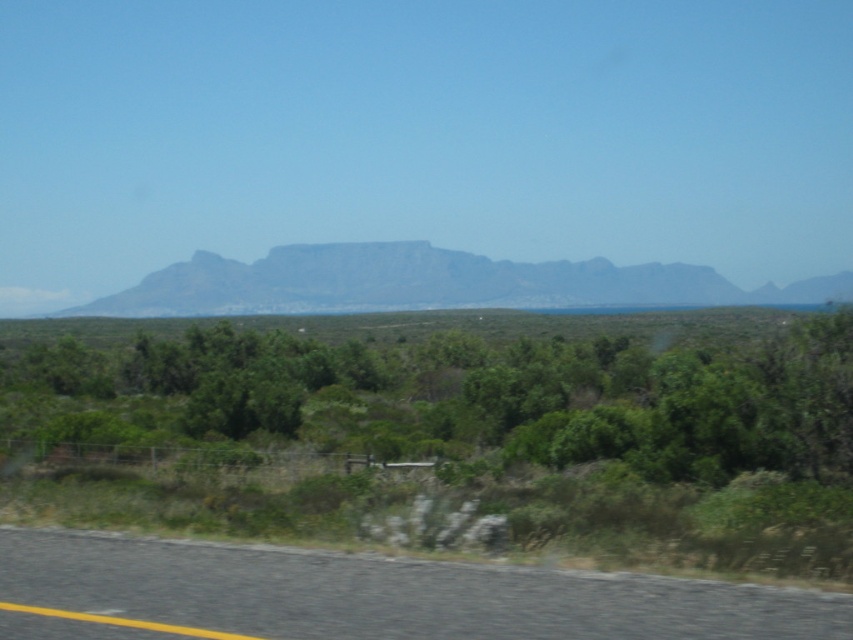
Does point (541, 358) lie behind point (520, 282)?

No, it is in front of (520, 282).

Which is more to the left, green leafy shrub at center or gray rocky mountain at center?

Positioned to the left is green leafy shrub at center.

Find the location of a particular element. This screenshot has width=853, height=640. green leafy shrub at center is located at coordinates pos(457,396).

Is point (508, 570) positioned before point (350, 278)?

Yes, point (508, 570) is in front of point (350, 278).

Who is more forward, [642,579] or [99,307]?

Point [642,579] is in front.

Find the location of `black asphalt road at lower left`. black asphalt road at lower left is located at coordinates (389, 593).

Does green leafy shrub at center appear over black asphalt road at lower left?

Indeed, green leafy shrub at center is positioned over black asphalt road at lower left.

Looking at this image, can you confirm if green leafy shrub at center is taller than black asphalt road at lower left?

Yes.

The width and height of the screenshot is (853, 640). Describe the element at coordinates (457, 396) in the screenshot. I see `green leafy shrub at center` at that location.

Locate an element on the screen. green leafy shrub at center is located at coordinates (457, 396).